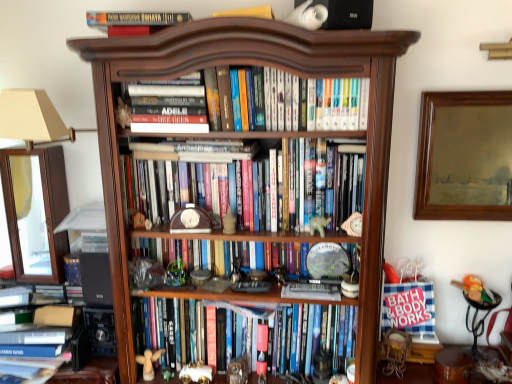
Question: Can you confirm if wooden clock at center, marked as the 2th book in a bottom-to-top arrangement, is thinner than hardcover book at top, the sixth book in the bottom-to-top sequence?

Choices:
 (A) no
 (B) yes

Answer: (B)

Question: Is wooden clock at center, marked as the 2th book in a bottom-to-top arrangement, oriented towards hardcover book at top, the sixth book in the bottom-to-top sequence?

Choices:
 (A) no
 (B) yes

Answer: (A)

Question: Considering the relative positions of wooden clock at center, which is the fifth book from top to bottom, and hardcover book at top, the sixth book in the bottom-to-top sequence, in the image provided, is wooden clock at center, which is the fifth book from top to bottom, to the left of hardcover book at top, the sixth book in the bottom-to-top sequence, from the viewer's perspective?

Choices:
 (A) no
 (B) yes

Answer: (A)

Question: From a real-world perspective, does wooden clock at center, which is the fifth book from top to bottom, stand above hardcover book at top, which is the first book from top to bottom?

Choices:
 (A) yes
 (B) no

Answer: (B)

Question: Is the depth of wooden clock at center, marked as the 2th book in a bottom-to-top arrangement, greater than that of hardcover book at top, the sixth book in the bottom-to-top sequence?

Choices:
 (A) yes
 (B) no

Answer: (A)

Question: From a real-world perspective, is hardcover books at center, the 2th book viewed from the top, physically located above or below wooden angel at lower center, the 5th toy from the top?

Choices:
 (A) below
 (B) above

Answer: (B)

Question: From the image's perspective, relative to wooden angel at lower center, the 5th toy from the top, is hardcover books at center, which appears as the fifth book when ordered from the bottom, above or below?

Choices:
 (A) below
 (B) above

Answer: (B)

Question: Relative to wooden angel at lower center, placed as the 2th toy when sorted from left to right, is hardcover books at center, the 2th book viewed from the top, in front or behind?

Choices:
 (A) front
 (B) behind

Answer: (A)

Question: From their relative heights in the image, would you say hardcover books at center, which appears as the fifth book when ordered from the bottom, is taller or shorter than wooden angel at lower center, placed as the 6th toy when sorted from right to left?

Choices:
 (A) tall
 (B) short

Answer: (A)

Question: From the image's perspective, relative to metallic black side table at lower right, is dark wood bookcase at center above or below?

Choices:
 (A) above
 (B) below

Answer: (A)

Question: Does point (384, 198) appear closer or farther from the camera than point (484, 309)?

Choices:
 (A) farther
 (B) closer

Answer: (B)

Question: Looking at the image, does dark wood bookcase at center seem bigger or smaller compared to metallic black side table at lower right?

Choices:
 (A) big
 (B) small

Answer: (A)

Question: Is dark wood bookcase at center situated inside metallic black side table at lower right or outside?

Choices:
 (A) inside
 (B) outside

Answer: (B)

Question: Considering the positions of hardcover book at center, acting as the 1th book starting from the bottom, and hardcover books at center, the 2th book viewed from the top, in the image, is hardcover book at center, acting as the 1th book starting from the bottom, taller or shorter than hardcover books at center, the 2th book viewed from the top,?

Choices:
 (A) tall
 (B) short

Answer: (A)

Question: Relative to hardcover books at center, which appears as the fifth book when ordered from the bottom, is hardcover book at center, acting as the 1th book starting from the bottom, in front or behind?

Choices:
 (A) behind
 (B) front

Answer: (A)